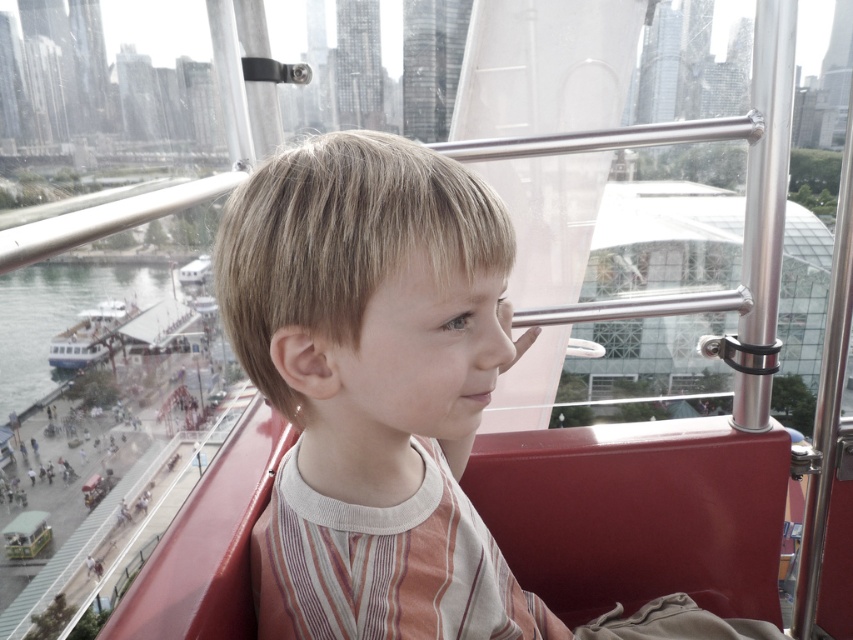
You are a photographer trying to capture the light brown hair at center in the image. The camera you are using has a focus point at coordinate point (374, 387). Will this focus point be effective for capturing the light brown hair at center?

Yes, the focus point at coordinate point (374, 387) will be effective because the light brown hair at center is located exactly at that coordinate.

You are a photographer trying to capture a photo of the white matte boat at lower left without the light brown hair at center blocking the view. Based on their heights, is it possible to take the photo from your current position?

The light brown hair at center is not as tall as the white matte boat at lower left, so it is possible to take the photo from your current position without the light brown hair at center blocking the view.